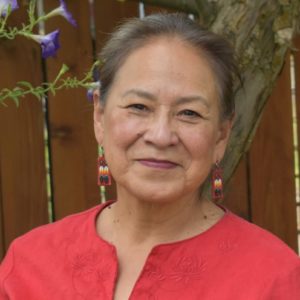
Where is `upper leftmost flower`? This screenshot has height=300, width=300. upper leftmost flower is located at coordinates (3, 4).